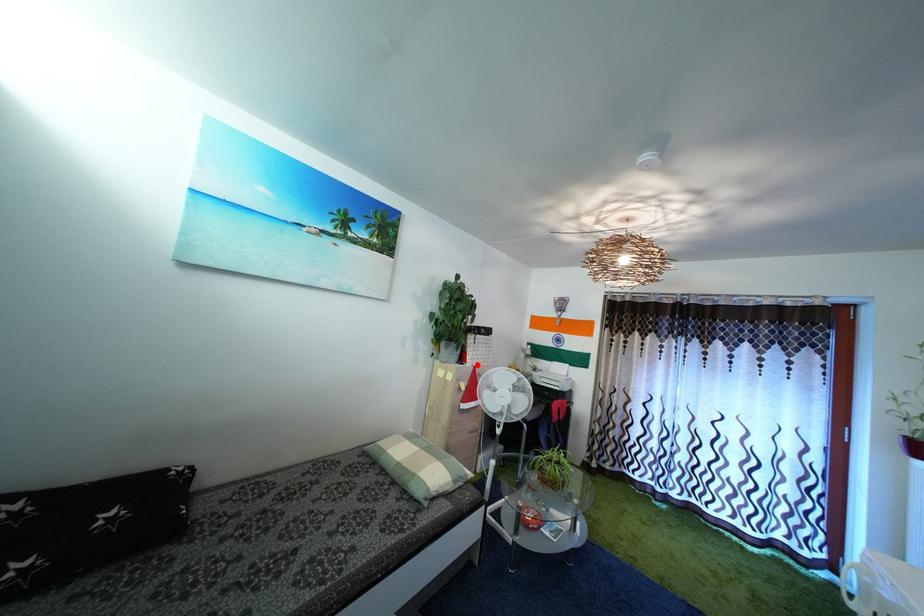
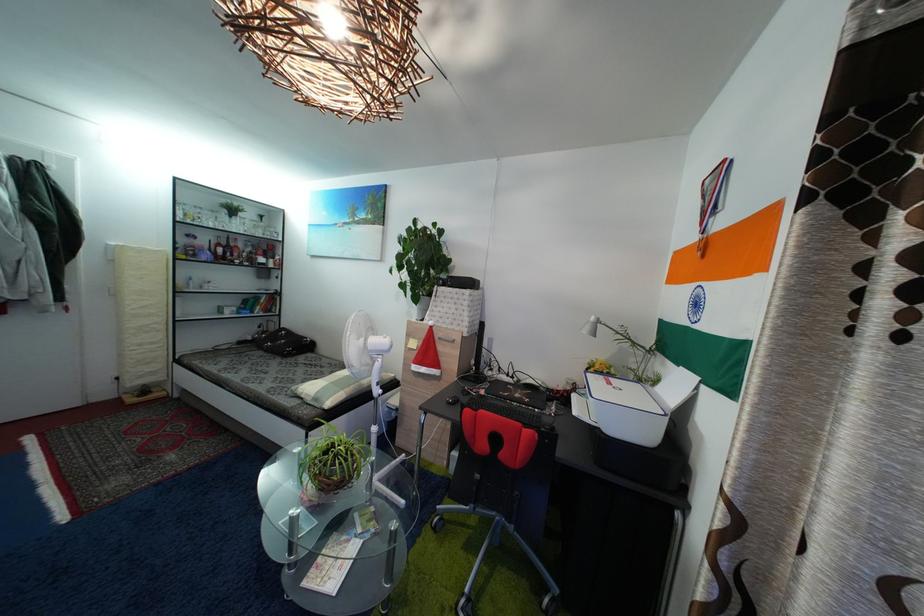
Where in the second image is the point corresponding to the highlighted location from the first image?

(435, 321)